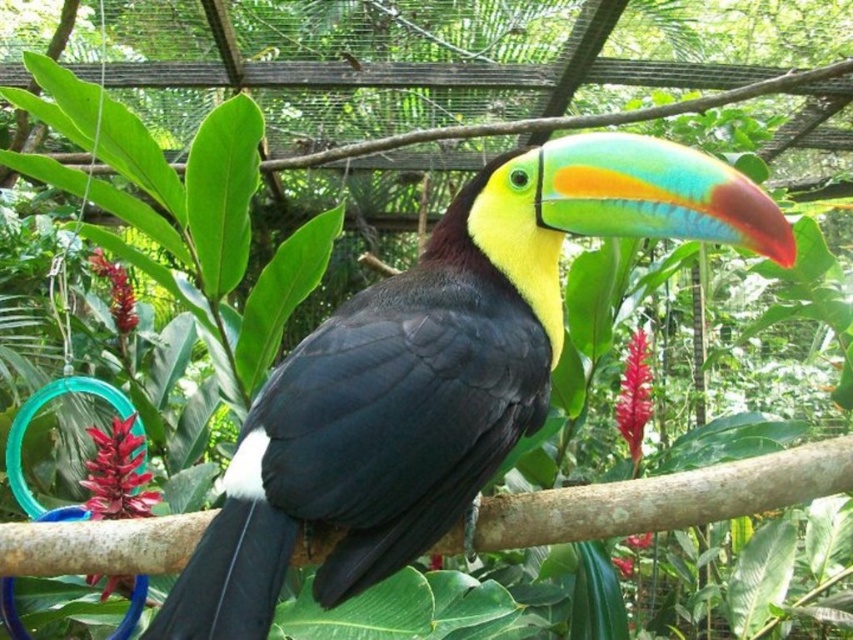
Question: Does shiny black toucan at center have a smaller size compared to brown wood at center?

Choices:
 (A) no
 (B) yes

Answer: (A)

Question: Can you confirm if shiny black toucan at center is positioned to the right of brown wood at center?

Choices:
 (A) no
 (B) yes

Answer: (B)

Question: Among these objects, which one is farthest from the camera?

Choices:
 (A) shiny black toucan at center
 (B) brown wood at center

Answer: (B)

Question: Is shiny black toucan at center to the right of brown wood at center from the viewer's perspective?

Choices:
 (A) yes
 (B) no

Answer: (A)

Question: Which point is closer to the camera taking this photo?

Choices:
 (A) (386, 356)
 (B) (827, 472)

Answer: (A)

Question: Which point is closer to the camera?

Choices:
 (A) shiny black toucan at center
 (B) brown wood at center

Answer: (A)